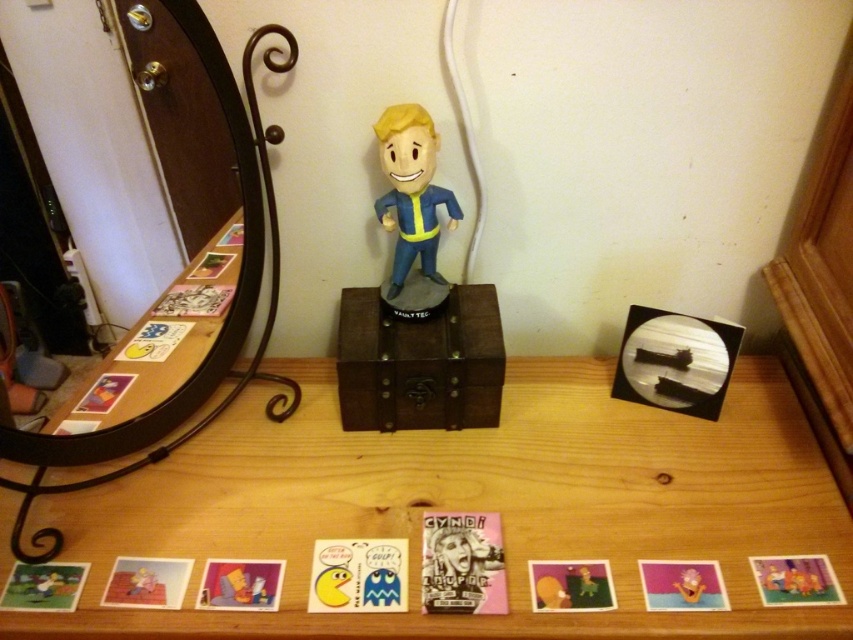
Is brown wooden chest at center to the left of matte plastic bobblehead at center from the viewer's perspective?

Incorrect, brown wooden chest at center is not on the left side of matte plastic bobblehead at center.

In the scene shown: Is brown wooden chest at center to the right of matte plastic bobblehead at center from the viewer's perspective?

Indeed, brown wooden chest at center is positioned on the right side of matte plastic bobblehead at center.

The height and width of the screenshot is (640, 853). Find the location of `brown wooden chest at center`. brown wooden chest at center is located at coordinates (421, 362).

This screenshot has width=853, height=640. What do you see at coordinates (473, 508) in the screenshot?
I see `wooden table at center` at bounding box center [473, 508].

Which of these two, wooden table at center or matte plastic bobblehead at center, stands taller?

With more height is wooden table at center.

Is point (787, 460) less distant than point (418, 228)?

No.

I want to click on wooden table at center, so click(x=473, y=508).

Does point (369, 330) come in front of point (102, 477)?

No, it is not.

What do you see at coordinates (421, 362) in the screenshot?
I see `brown wooden chest at center` at bounding box center [421, 362].

I want to click on brown wooden chest at center, so click(421, 362).